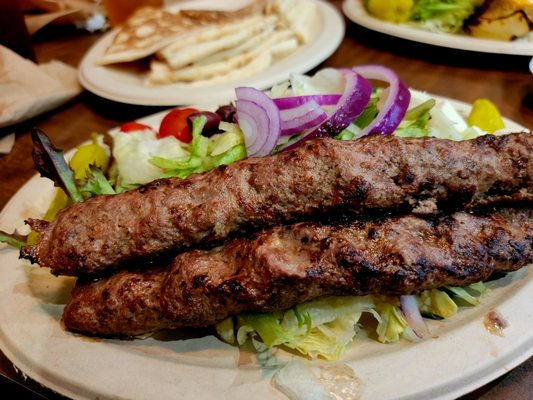
This screenshot has height=400, width=533. I want to click on table, so click(430, 75).